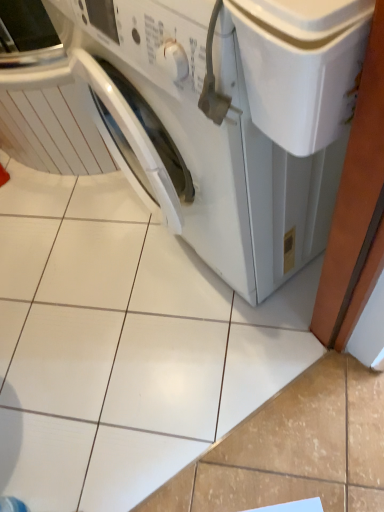
This screenshot has width=384, height=512. What do you see at coordinates (198, 114) in the screenshot? I see `white glossy washing machine at center` at bounding box center [198, 114].

You are a GUI agent. You are given a task and a screenshot of the screen. Output one action in this format:
    pyautogui.click(x=<x>, y=<y>)
    Task: Click on the white glossy washing machine at center
    
    Given the screenshot: What is the action you would take?
    pyautogui.click(x=198, y=114)

Find the location of `white glossy washing machine at center`. white glossy washing machine at center is located at coordinates click(198, 114).